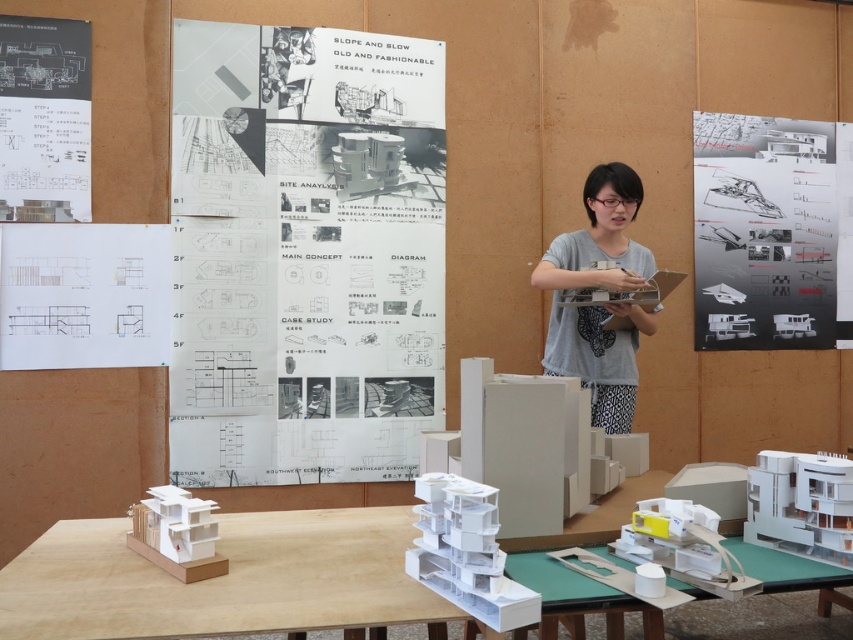
The width and height of the screenshot is (853, 640). I want to click on white paper poster at center, so click(x=305, y=253).

Is point (227, 156) positioned behind point (83, 32)?

Yes, point (227, 156) is farther from viewer.

What do you see at coordinates (305, 253) in the screenshot? This screenshot has width=853, height=640. I see `white paper poster at center` at bounding box center [305, 253].

This screenshot has height=640, width=853. I want to click on white paper poster at center, so click(x=305, y=253).

Is white paper poster at center above white paper at left?

Indeed, white paper poster at center is positioned over white paper at left.

The height and width of the screenshot is (640, 853). What do you see at coordinates (305, 253) in the screenshot?
I see `white paper poster at center` at bounding box center [305, 253].

At what (x,y) coordinates should I click in order to perform the action: click on white paper poster at center. Please return your answer as a coordinate pair (x, y). Looking at the image, I should click on (305, 253).

Does gray cotton shirt at center appear on the right side of white cardboard table at center?

Yes, gray cotton shirt at center is to the right of white cardboard table at center.

Who is positioned more to the left, gray cotton shirt at center or white cardboard table at center?

white cardboard table at center

Identify the location of gray cotton shirt at center. This screenshot has width=853, height=640. (605, 304).